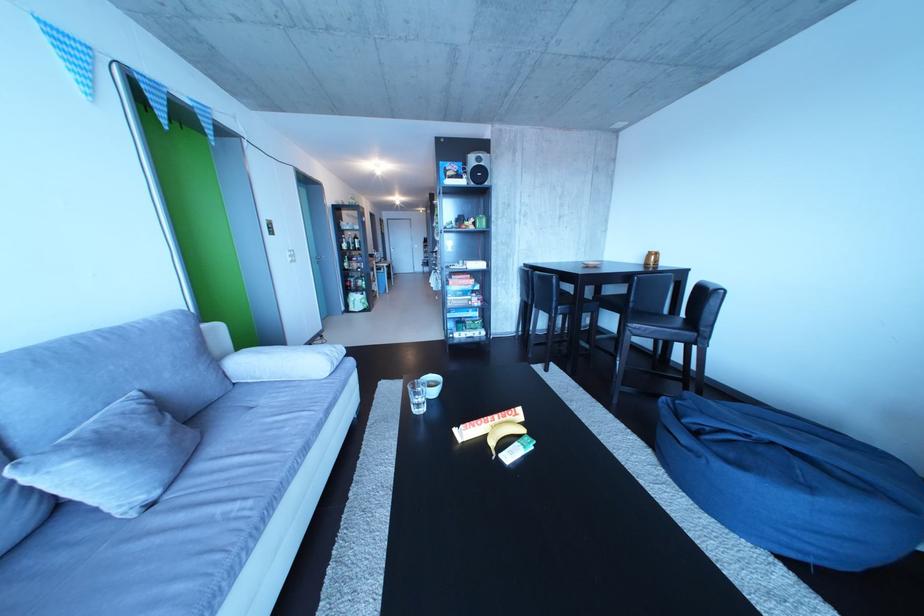
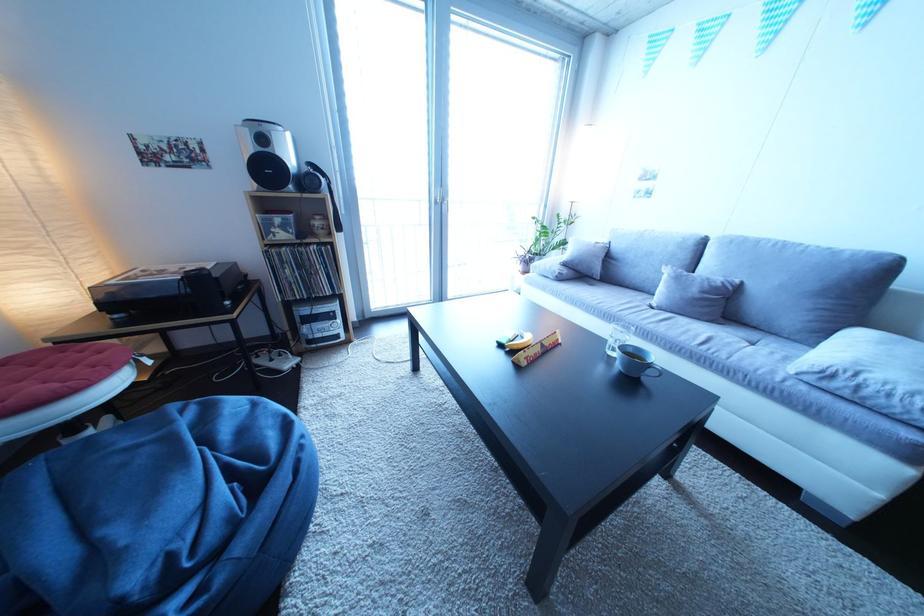
Locate, in the second image, the point that corresponds to the point at 148,400 in the first image.

(750, 286)